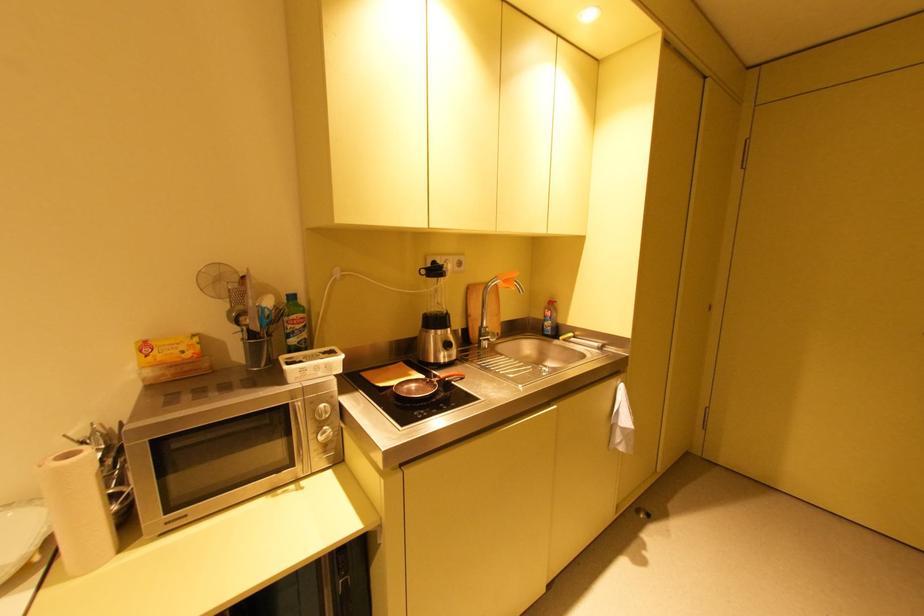
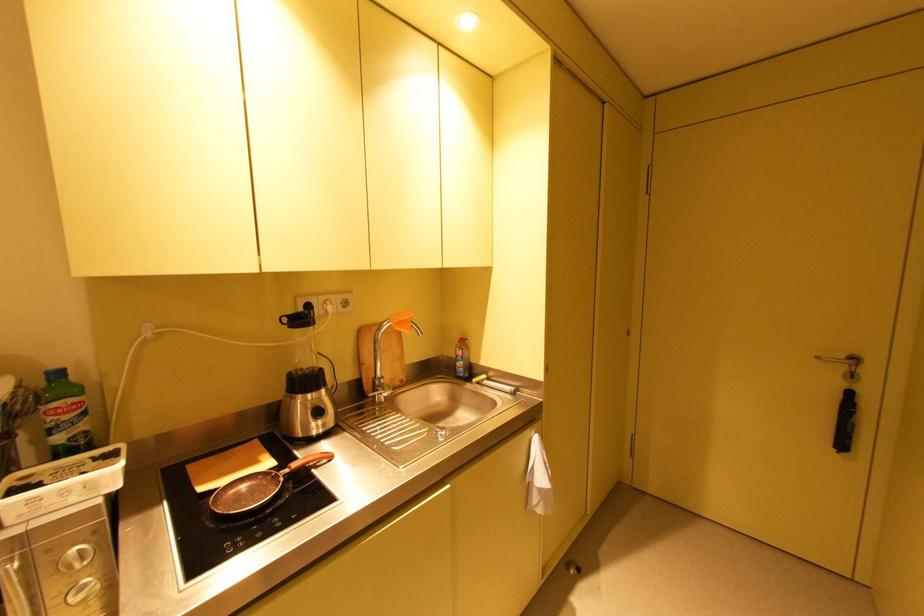
Question: The images are taken continuously from a first-person perspective. In which direction is your viewpoint rotating?

Choices:
 (A) Left
 (B) Right
 (C) Up
 (D) Down

Answer: (B)